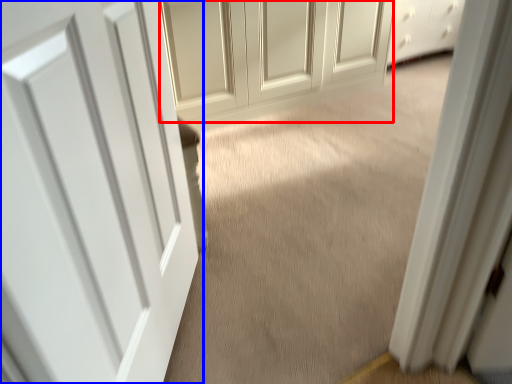
Question: Which object appears closest to the camera in this image, door (highlighted by a red box) or door (highlighted by a blue box)?

Choices:
 (A) door
 (B) door

Answer: (B)